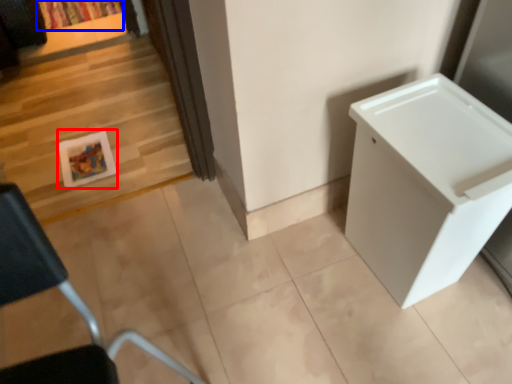
Question: Which object appears closest to the camera in this image, picture frame (highlighted by a red box) or curtain (highlighted by a blue box)?

Choices:
 (A) picture frame
 (B) curtain

Answer: (A)